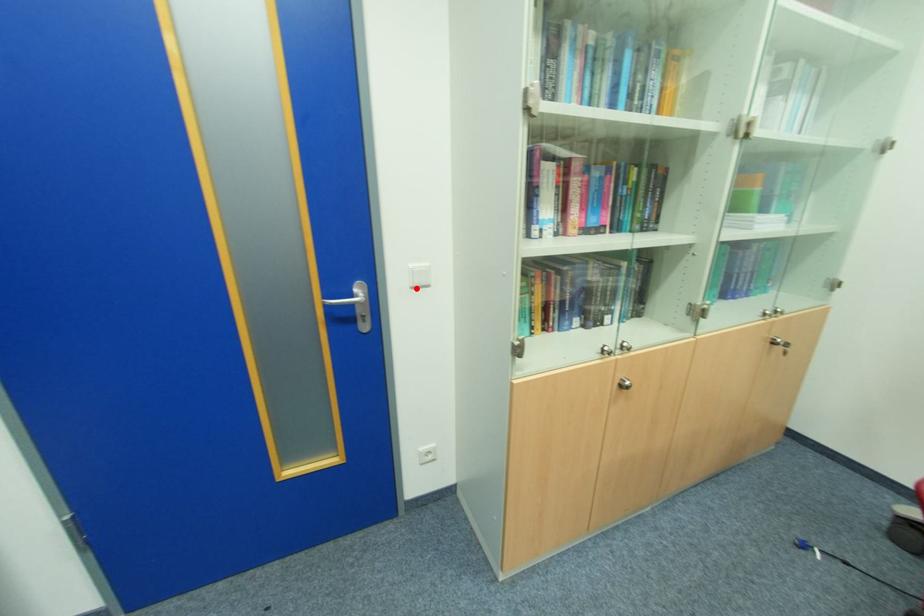
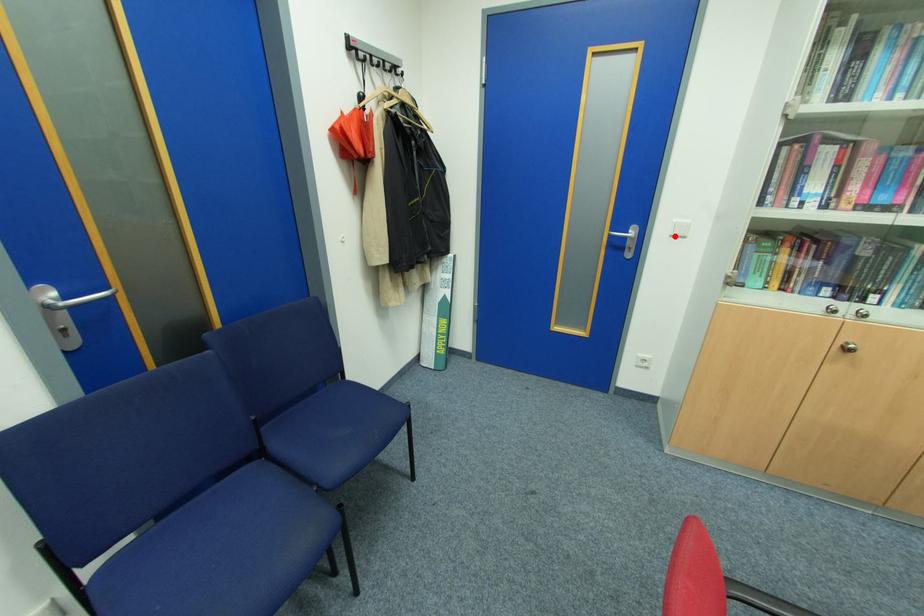
I am providing you with two images of the same scene from different viewpoints. A red point is marked on the first image and another point is marked on the second image. Does the point marked in image1 correspond to the same location as the one in image2?

Yes